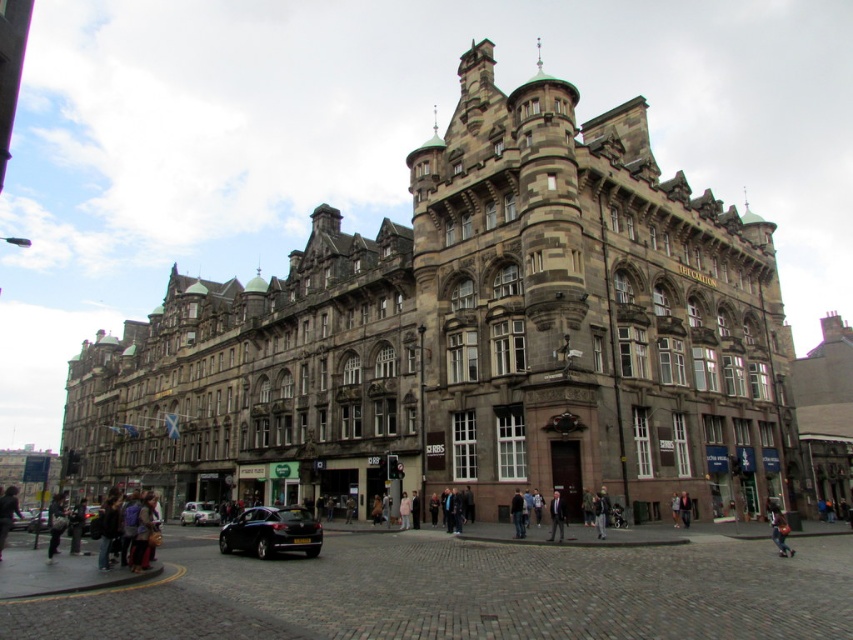
Question: Which object is the farthest from the shiny black car at lower left?

Choices:
 (A) light blue shirt at center
 (B) dark brown leather jacket at lower left

Answer: (A)

Question: Can you confirm if dark brown leather jacket at lower left is smaller than dark brown leather jacket at center?

Choices:
 (A) yes
 (B) no

Answer: (B)

Question: From the image, what is the correct spatial relationship of light blue shirt at center in relation to light blue denim jacket at lower right?

Choices:
 (A) left
 (B) right

Answer: (A)

Question: Does light brown leather jacket at lower right have a larger size compared to pink fabric coat at center?

Choices:
 (A) yes
 (B) no

Answer: (A)

Question: Based on their relative distances, which object is nearer to the light blue shirt at center?

Choices:
 (A) dark brown leather jacket at lower left
 (B) light blue denim jacket at lower right
 (C) metallic silver car at center
 (D) pink fabric coat at center

Answer: (B)

Question: Among these points, which one is farthest from the camera?

Choices:
 (A) (773, 509)
 (B) (399, 518)
 (C) (561, 540)

Answer: (B)